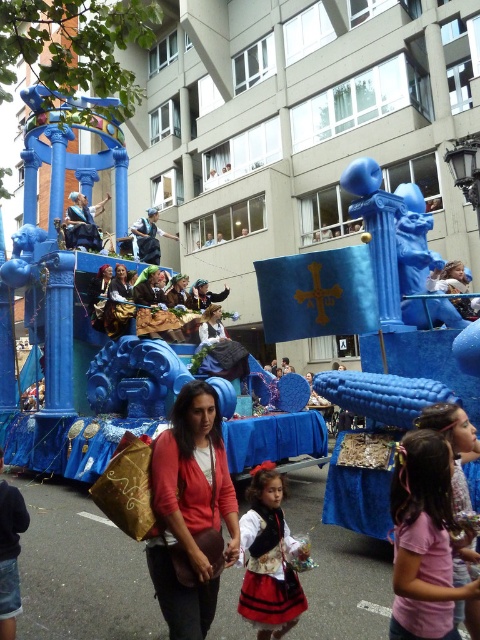
You are a participant in the parade and want to move from the float to the crowd. You are currently at point (275, 522) and need to reach point (124, 310). Which direction should you move to get closer to your destination?

You should move backward because point (275, 522) is in front of point (124, 310), so moving backward will bring you closer to the destination.

You are standing on the street and see two points marked in the parade image. Which point, point (396, 536) or point (247, 582), is closer to you?

Point (396, 536) is closer to the viewer than point (247, 582).